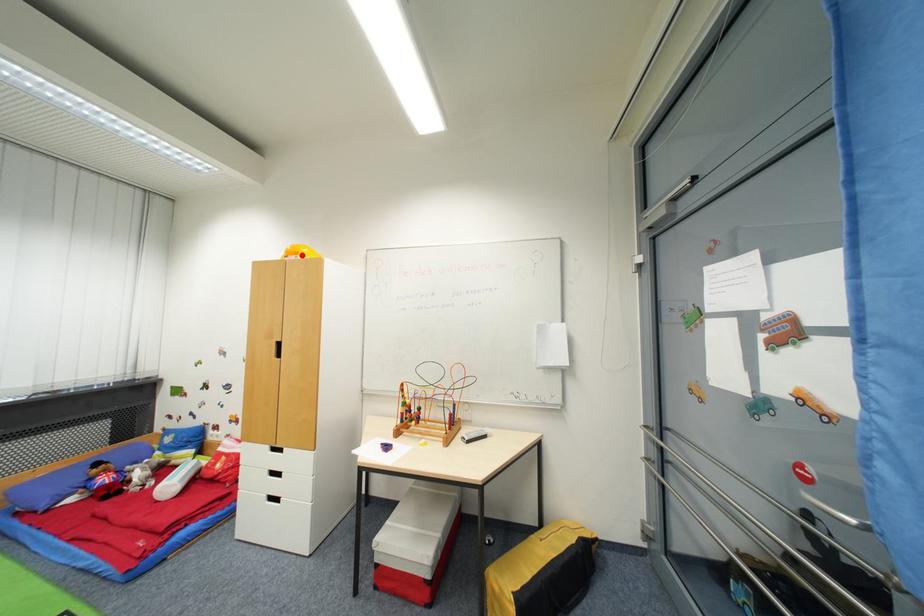
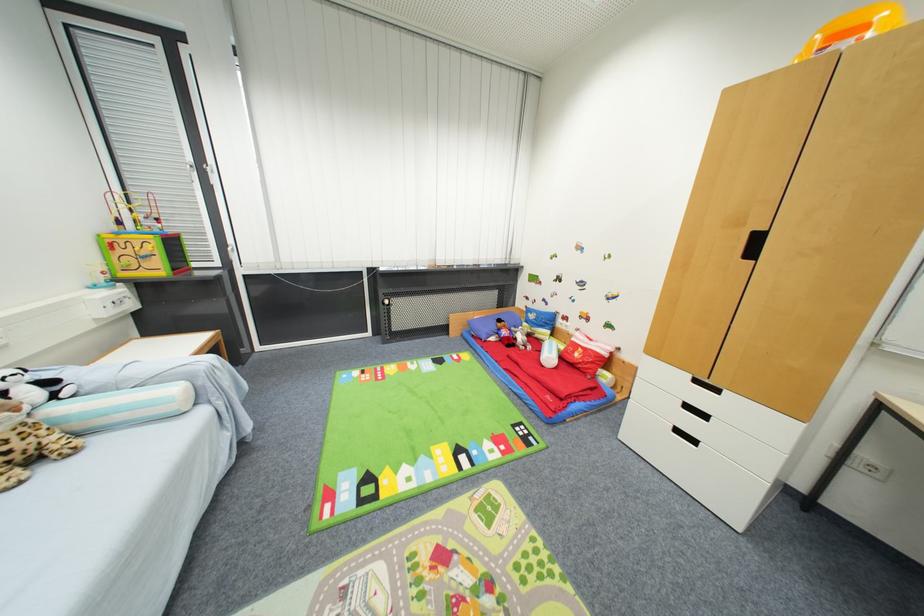
Find the pixel in the second image that matches the highlighted location in the first image.

(868, 30)